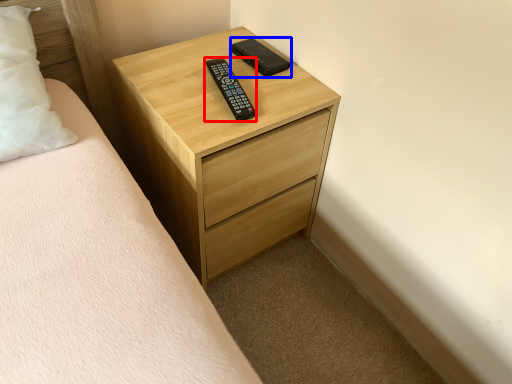
Question: Which of the following is the closest to the observer, control (highlighted by a red box) or control (highlighted by a blue box)?

Choices:
 (A) control
 (B) control

Answer: (A)